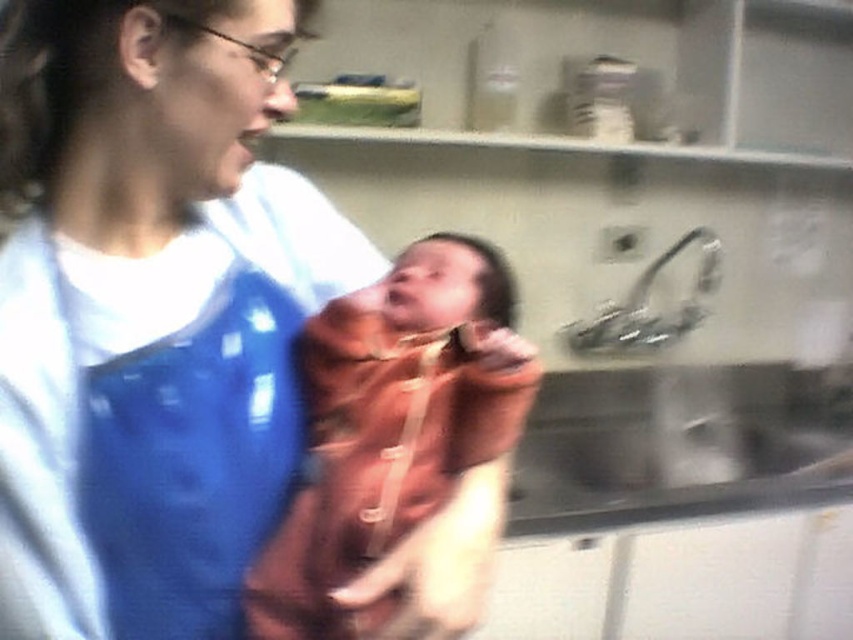
Question: Is blue fabric shirt at center wider than soft brown blanket at center?

Choices:
 (A) no
 (B) yes

Answer: (B)

Question: Can you confirm if blue fabric shirt at center is smaller than soft brown blanket at center?

Choices:
 (A) no
 (B) yes

Answer: (A)

Question: Is blue fabric shirt at center below soft brown blanket at center?

Choices:
 (A) no
 (B) yes

Answer: (A)

Question: Which point is farther to the camera?

Choices:
 (A) blue fabric shirt at center
 (B) soft brown blanket at center

Answer: (B)

Question: Among these points, which one is farthest from the camera?

Choices:
 (A) (15, 88)
 (B) (352, 372)

Answer: (B)

Question: Which point is closer to the camera taking this photo?

Choices:
 (A) (463, 602)
 (B) (33, 477)

Answer: (B)